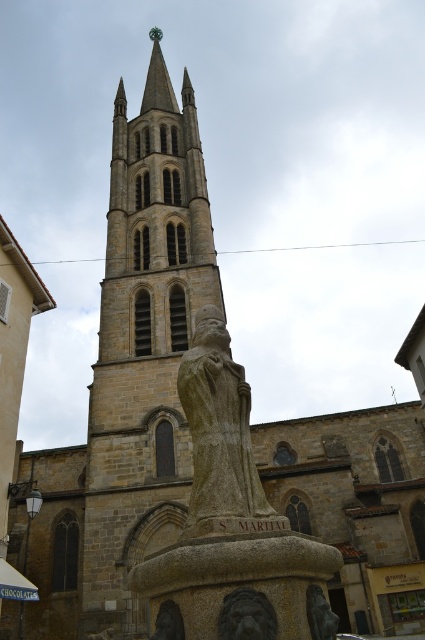
Question: Observing the image, what is the correct spatial positioning of gray stone statue at center in reference to matte stone lion at lower center?

Choices:
 (A) left
 (B) right

Answer: (B)

Question: Does stone statue at center have a lesser width compared to carved stone lion at center?

Choices:
 (A) no
 (B) yes

Answer: (A)

Question: Is stone statue at center positioned at the back of gray stone statue at center?

Choices:
 (A) yes
 (B) no

Answer: (A)

Question: Which object is closer to the camera taking this photo?

Choices:
 (A) carved stone lion at center
 (B) stone statue at center

Answer: (A)

Question: Which object appears closest to the camera in this image?

Choices:
 (A) carved stone lion at center
 (B) stone statue at center
 (C) gray stone statue at center

Answer: (A)

Question: Which object is positioned closest to the carved stone lion at center?

Choices:
 (A) stone statue at center
 (B) gray stone statue at center

Answer: (B)